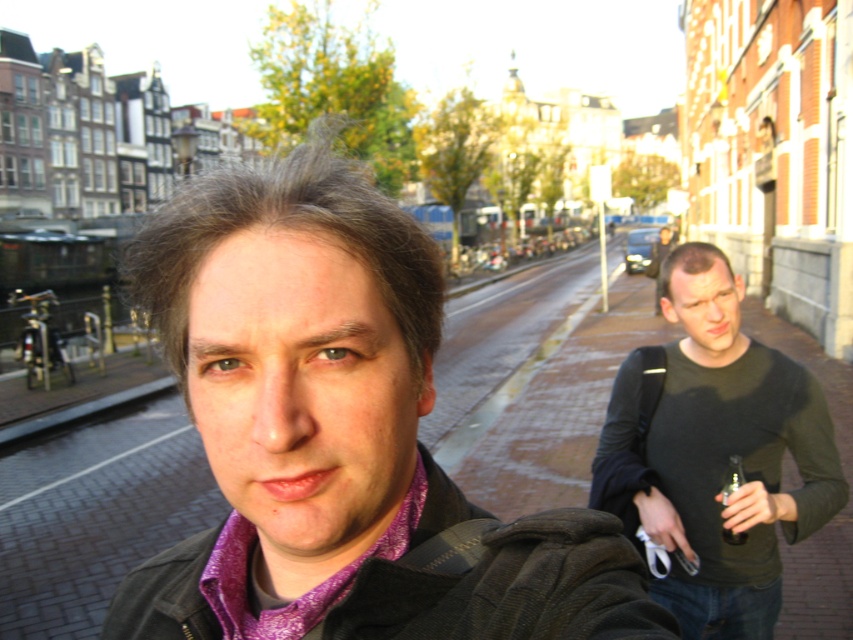
Question: Is dark green textured jacket at center to the left of clear plastic bottle at center from the viewer's perspective?

Choices:
 (A) no
 (B) yes

Answer: (B)

Question: Which object is farther from the camera taking this photo?

Choices:
 (A) purple woven shirt at center
 (B) purple patterned scarf at center

Answer: (B)

Question: Is dark green sweater at right to the right of clear plastic bottle at center from the viewer's perspective?

Choices:
 (A) no
 (B) yes

Answer: (B)

Question: Does dark green textured jacket at center appear on the left side of purple patterned scarf at center?

Choices:
 (A) no
 (B) yes

Answer: (A)

Question: Which object is closer to the camera taking this photo?

Choices:
 (A) dark green sweater at right
 (B) purple woven shirt at center
 (C) purple patterned scarf at center
 (D) clear plastic bottle at center

Answer: (B)

Question: Estimate the real-world distances between objects in this image. Which object is closer to the purple patterned scarf at center?

Choices:
 (A) dark green sweater at right
 (B) dark green textured jacket at center

Answer: (B)